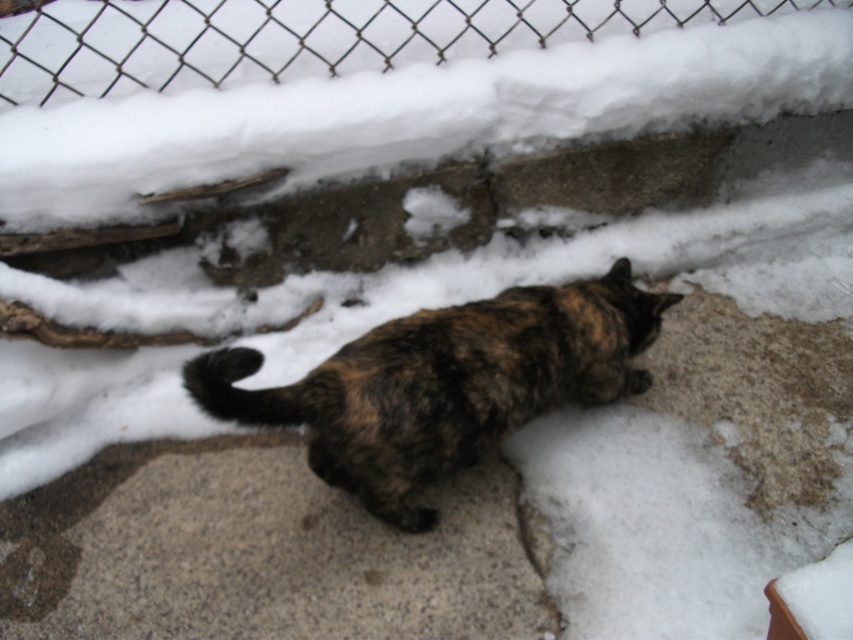
Between brown fur cat at center and wire mesh fence at upper center, which one appears on the left side from the viewer's perspective?

wire mesh fence at upper center is more to the left.

Between brown fur cat at center and wire mesh fence at upper center, which one is positioned lower?

Positioned lower is brown fur cat at center.

Identify the location of brown fur cat at center. click(444, 384).